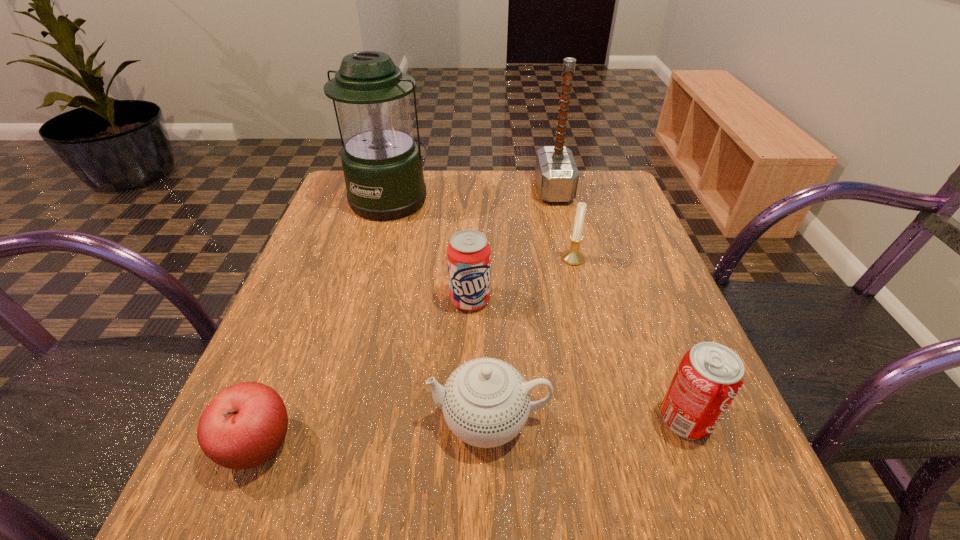
Identify the location of object that is positioned at the far right corner. This screenshot has width=960, height=540. (557, 176).

I want to click on vacant region at the far edge of the desktop, so click(x=444, y=171).

Where is `free spot at the near edge of the desktop`? The width and height of the screenshot is (960, 540). free spot at the near edge of the desktop is located at coordinates (556, 471).

In the image, there is a desktop. Identify the location of vacant space at the left edge. This screenshot has width=960, height=540. (274, 337).

In order to click on free space at the right edge of the desktop in this screenshot , I will do `click(655, 307)`.

Find the location of a particular element. This screenshot has width=960, height=540. free space at the far left corner is located at coordinates (350, 215).

You are a GUI agent. You are given a task and a screenshot of the screen. Output one action in this format:
    pyautogui.click(x=<x>, y=<y>)
    Task: Click on the free location at the near left corner
    This screenshot has height=540, width=960.
    Given the screenshot: What is the action you would take?
    pyautogui.click(x=247, y=480)

Image resolution: width=960 pixels, height=540 pixels. Identify the location of free space that is in between the farther soda can and the third farthest object. (521, 279).

I want to click on free space between the farther soda can and the hammer, so click(x=512, y=245).

Where is `free spot between the lantern and the chinaware`? The width and height of the screenshot is (960, 540). free spot between the lantern and the chinaware is located at coordinates (440, 308).